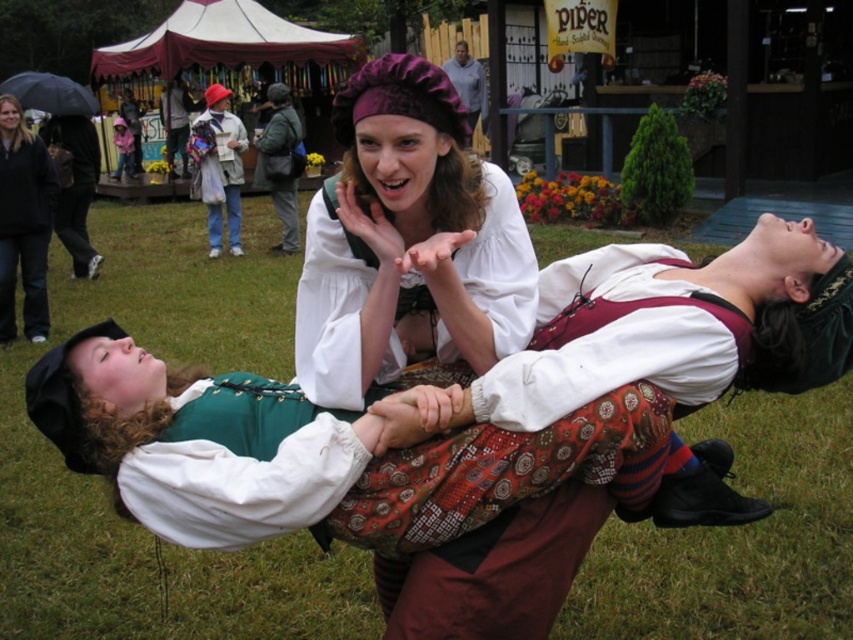
You are an event organizer at the festival and need to ensure that the denim jacket at upper center and the green fabric jacket at center can both fit on a display rack that has a maximum width of 1.2 meters. Based on their sizes, will both jackets fit on the rack together?

The denim jacket at upper center is bigger than the green fabric jacket at center. However, without specific measurements, it is impossible to determine if their combined width will exceed the rack limit. Please check the actual sizes.

Based on the photo, based on the scene description, which object is positioned lower in the image? The white cotton blouse at center or the matte black jacket at upper center?

The white cotton blouse at center is positioned lower than the matte black jacket at upper center.